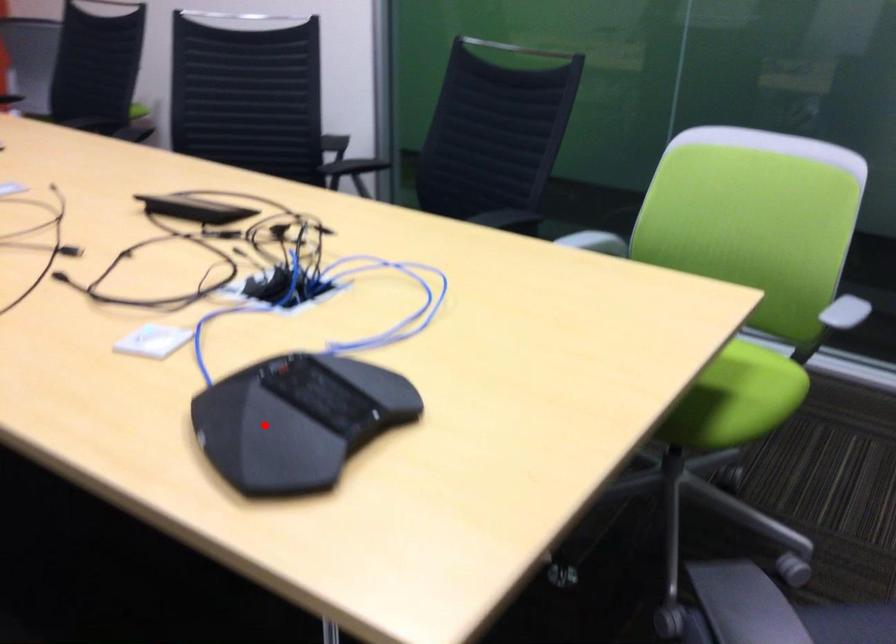
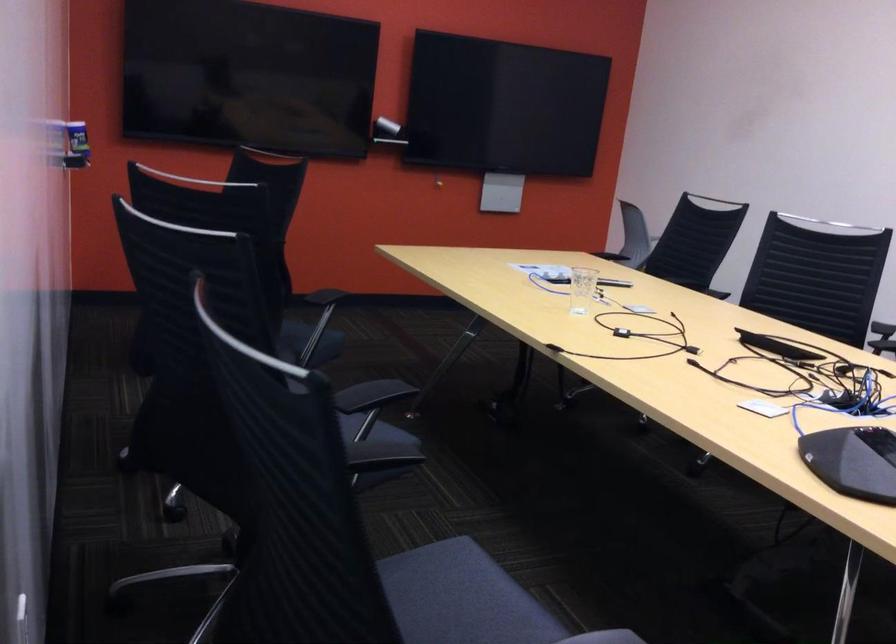
Question: I am providing you with two images of the same scene from different viewpoints. Given a red point in image1, look at the same physical point in image2. Is it:

Choices:
 (A) Closer to the viewpoint
 (B) Farther from the viewpoint

Answer: (B)